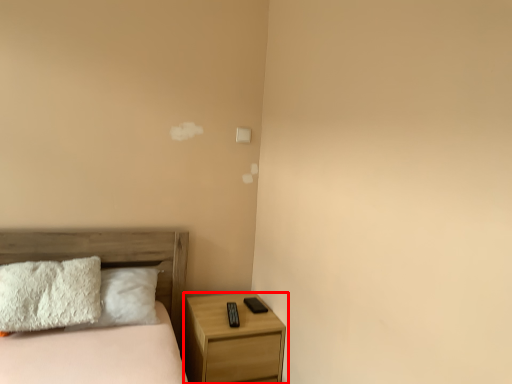
Question: From the image's perspective, considering the relative positions of nightstand (annotated by the red box) and bed in the image provided, where is nightstand (annotated by the red box) located with respect to the staircase?

Choices:
 (A) above
 (B) below

Answer: (B)